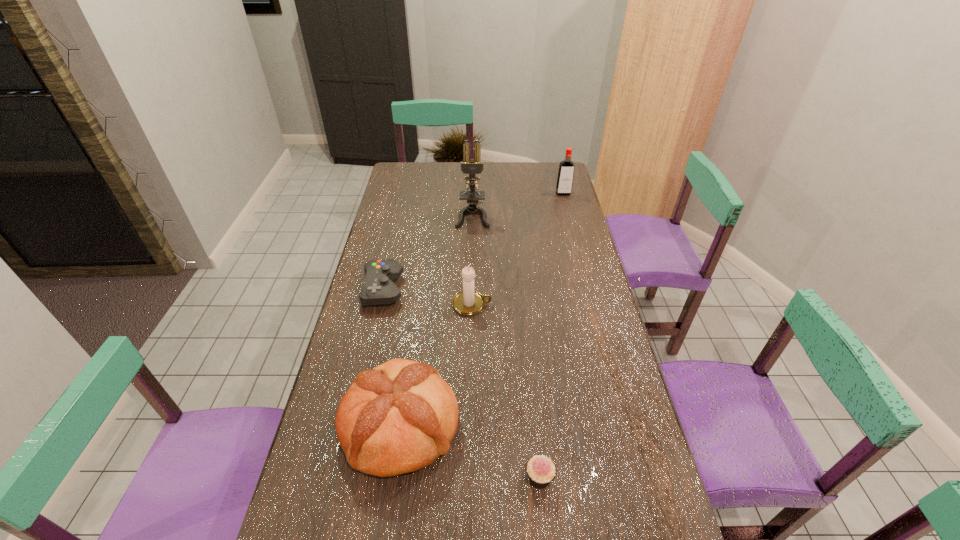
Locate an element on the screen. Image resolution: width=960 pixels, height=540 pixels. blank space located on the handle side of the candle holder is located at coordinates (531, 305).

This screenshot has height=540, width=960. What are the coordinates of `vacant space located 0.210m on the right of the bread` in the screenshot? It's located at (540, 425).

At what (x,y) coordinates should I click in order to perform the action: click on free point located 0.180m on the right of the fifth object from left to right. Please return your answer as a coordinate pair (x, y). This screenshot has height=540, width=960. Looking at the image, I should click on (631, 478).

Locate an element on the screen. The width and height of the screenshot is (960, 540). blank space located on the back of the control is located at coordinates (394, 245).

Identify the location of bread that is at the left edge. The image size is (960, 540). (399, 417).

You are a GUI agent. You are given a task and a screenshot of the screen. Output one action in this format:
    pyautogui.click(x=<x>, y=<y>)
    Task: Click on the control present at the left edge
    
    Given the screenshot: What is the action you would take?
    pyautogui.click(x=379, y=288)

Find the location of a particular element. object present at the right edge is located at coordinates (565, 176).

In the image, there is a desktop. At what (x,y) coordinates should I click in order to perform the action: click on vacant region at the far edge. Please return your answer as a coordinate pair (x, y). This screenshot has width=960, height=540. Looking at the image, I should click on (518, 168).

The width and height of the screenshot is (960, 540). In order to click on vacant space at the left edge of the desktop in this screenshot , I will do `click(361, 342)`.

The height and width of the screenshot is (540, 960). Find the location of `vacant space at the right edge of the desktop`. vacant space at the right edge of the desktop is located at coordinates (609, 478).